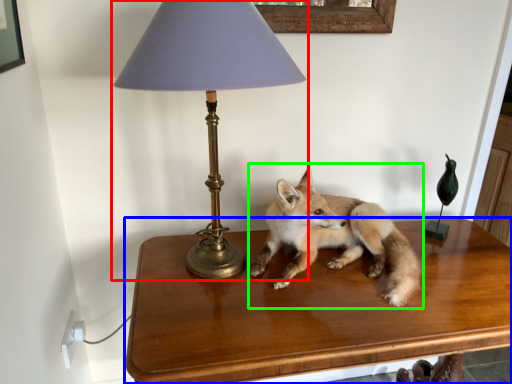
Question: Estimate the real-world distances between objects in this image. Which object is closer to lamp (highlighted by a red box), table (highlighted by a blue box) or fox (highlighted by a green box)?

Choices:
 (A) table
 (B) fox

Answer: (B)